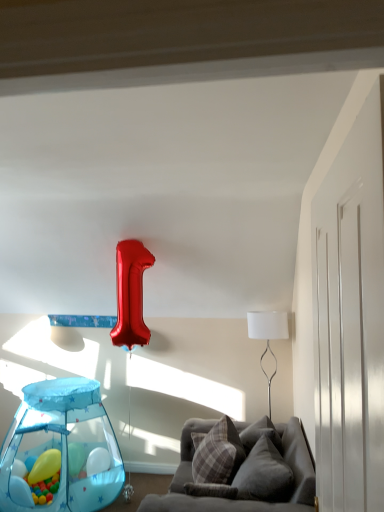
Question: From a real-world perspective, relative to plaid fabric pillow at center, arranged as the second pillow when viewed from the front, is velvet gray couch at lower right vertically above or below?

Choices:
 (A) above
 (B) below

Answer: (B)

Question: Is velvet gray couch at lower right taller or shorter than plaid fabric pillow at center, placed as the 1th pillow when sorted from back to front?

Choices:
 (A) tall
 (B) short

Answer: (A)

Question: Estimate the real-world distances between objects in this image. Which object is farther from the velvet gray pillow at lower right, the 2th pillow viewed from the back?

Choices:
 (A) rubber yellow ball at lower left, the 2th balloon when ordered from front to back
 (B) translucent plastic play tent at lower left
 (C) white fabric lampshade at upper right
 (D) plaid fabric pillow at center, arranged as the second pillow when viewed from the front
 (E) translucent blue balloon at lower left, which is the first balloon from front to back

Answer: (E)

Question: Estimate the real-world distances between objects in this image. Which object is closer to the translucent blue balloon at lower left, which is the first balloon from front to back?

Choices:
 (A) velvet gray couch at lower right
 (B) plaid fabric pillow at center, placed as the 1th pillow when sorted from back to front
 (C) translucent plastic play tent at lower left
 (D) rubber yellow ball at lower left, positioned as the 1th balloon in back-to-front order
 (E) white fabric lampshade at upper right

Answer: (D)